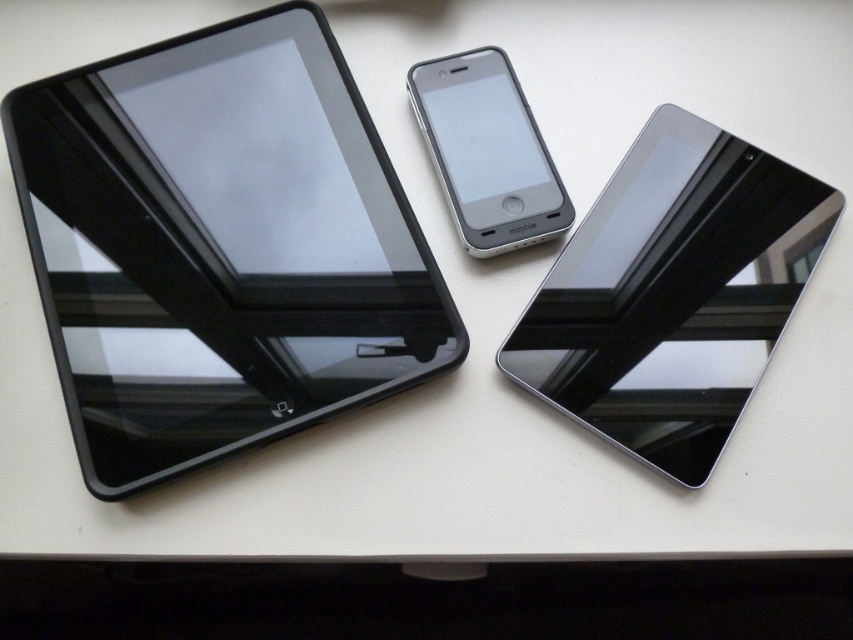
Does black glossy tablet at left lie behind matte black tablet at center?

No, black glossy tablet at left is closer to the viewer.

Can you confirm if black glossy tablet at left is positioned below matte black tablet at center?

Correct, black glossy tablet at left is located below matte black tablet at center.

Is point (85, 458) closer to camera compared to point (480, 140)?

Yes, it is in front of point (480, 140).

The image size is (853, 640). In order to click on black glossy tablet at left in this screenshot , I will do `click(219, 246)`.

Is point (383, 364) positioned before point (769, 189)?

Yes, point (383, 364) is in front of point (769, 189).

Who is shorter, black glossy tablet at left or glossy black tablet at center?

With less height is glossy black tablet at center.

Is point (114, 252) positioned behind point (657, 282)?

No.

Where is `black glossy tablet at left`? The width and height of the screenshot is (853, 640). black glossy tablet at left is located at coordinates (219, 246).

Is glossy black tablet at center above matte black tablet at center?

No.

The image size is (853, 640). Find the location of `glossy black tablet at center`. glossy black tablet at center is located at coordinates pos(672,292).